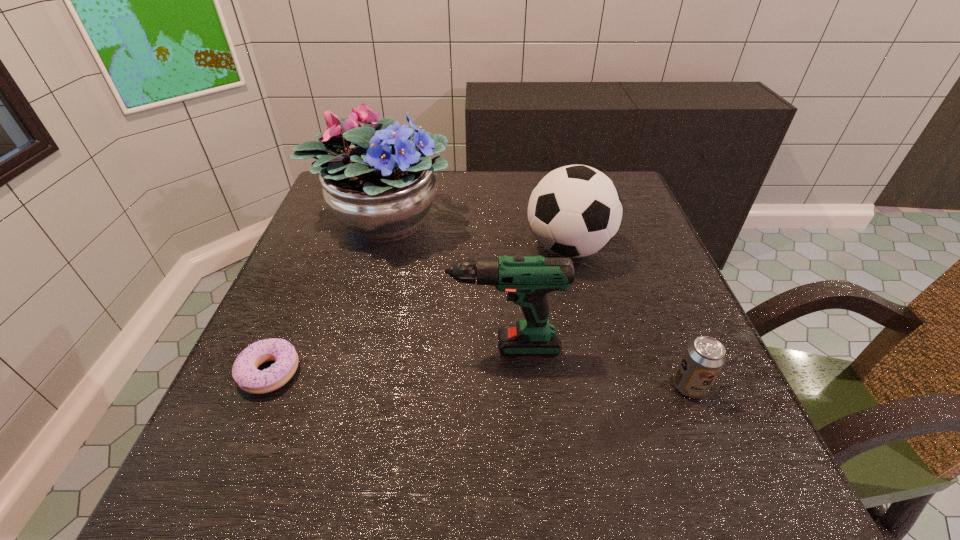
Where is `vacant region at the left edge`? vacant region at the left edge is located at coordinates (339, 243).

In the image, there is a desktop. At what (x,y) coordinates should I click in order to perform the action: click on vacant space at the right edge. Please return your answer as a coordinate pair (x, y). Looking at the image, I should click on (616, 307).

Image resolution: width=960 pixels, height=540 pixels. In order to click on vacant space at the near left corner of the desktop in this screenshot , I will do `click(302, 477)`.

In the image, there is a desktop. Identify the location of vacant space at the near right corner. The height and width of the screenshot is (540, 960). (677, 490).

Locate an element on the screen. free space between the shortest object and the drill is located at coordinates (382, 360).

Find the location of `vacant point located between the drill and the tallest object`. vacant point located between the drill and the tallest object is located at coordinates (439, 282).

Identify the location of empty space that is in between the second shortest object and the shortest object. The width and height of the screenshot is (960, 540). (479, 380).

Where is `empty space between the doughnut and the bouquet`? empty space between the doughnut and the bouquet is located at coordinates (326, 295).

The width and height of the screenshot is (960, 540). Find the location of `empty space between the tallest object and the soccer ball`. empty space between the tallest object and the soccer ball is located at coordinates (476, 233).

Locate an element on the screen. The image size is (960, 540). vacant space that is in between the doughnut and the beer can is located at coordinates tap(479, 380).